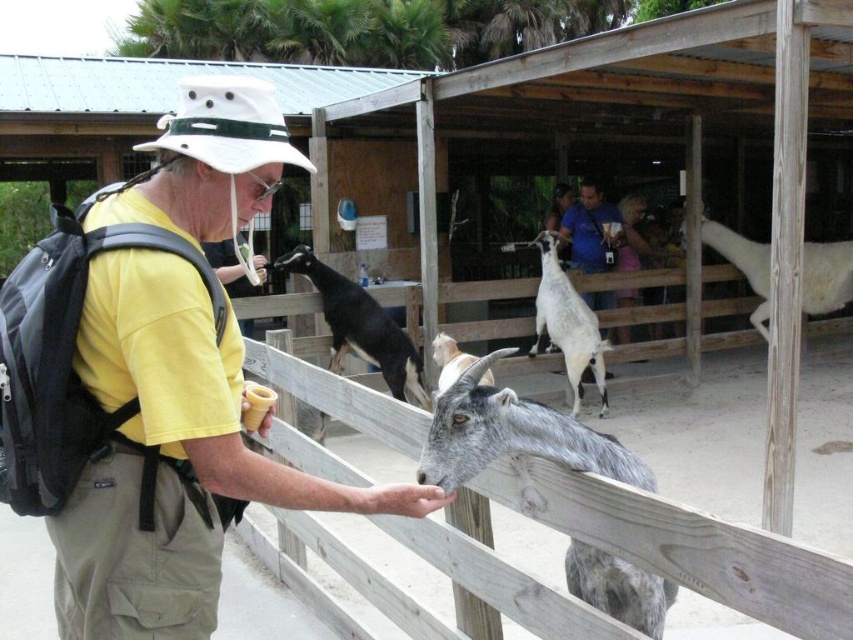
Does black glossy goat at center come in front of white woolen goat at upper right?

Yes, black glossy goat at center is in front of white woolen goat at upper right.

Can you confirm if black glossy goat at center is positioned above white woolen goat at upper right?

No.

Is point (360, 301) positioned after point (848, 243)?

No, it is not.

At what (x,y) coordinates should I click in order to perform the action: click on black glossy goat at center. Please return your answer as a coordinate pair (x, y). Looking at the image, I should click on (358, 324).

Does gray woolen goat at center appear under white woolen goat at upper right?

Correct, gray woolen goat at center is located below white woolen goat at upper right.

Find the location of a particular element. The width and height of the screenshot is (853, 640). gray woolen goat at center is located at coordinates (x=514, y=435).

Between gray woolen goat at center and black glossy goat at center, which one is positioned lower?

gray woolen goat at center is lower down.

Is gray woolen goat at center shorter than black glossy goat at center?

Correct, gray woolen goat at center is not as tall as black glossy goat at center.

This screenshot has height=640, width=853. What do you see at coordinates (514, 435) in the screenshot?
I see `gray woolen goat at center` at bounding box center [514, 435].

The image size is (853, 640). Find the location of `gray woolen goat at center`. gray woolen goat at center is located at coordinates (514, 435).